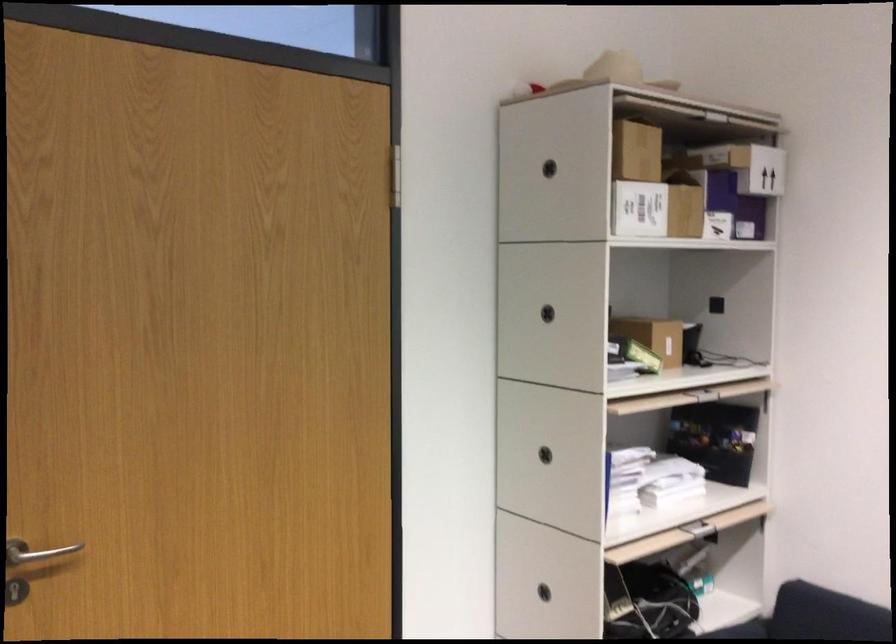
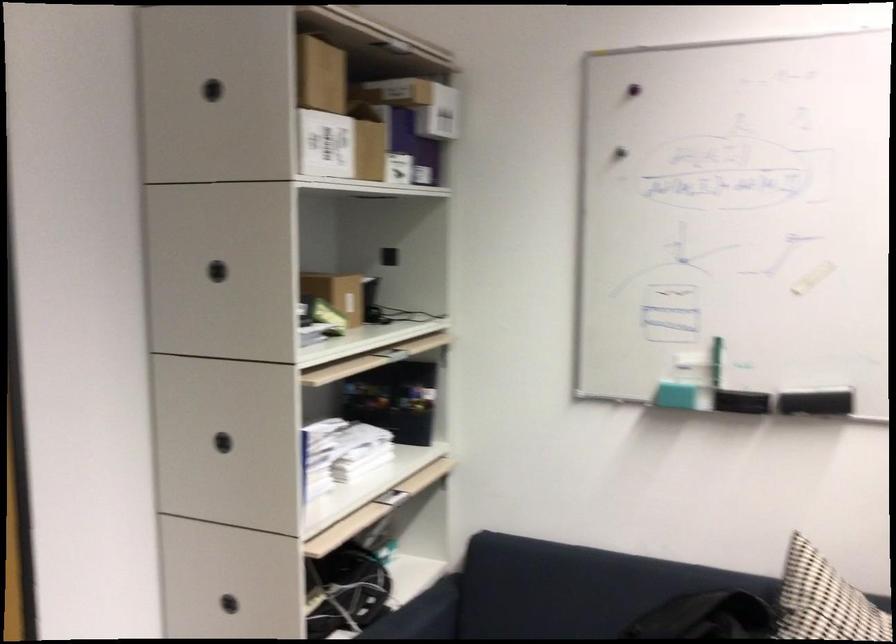
Find the pixel in the second image that matches point 545,313 in the first image.

(217, 270)